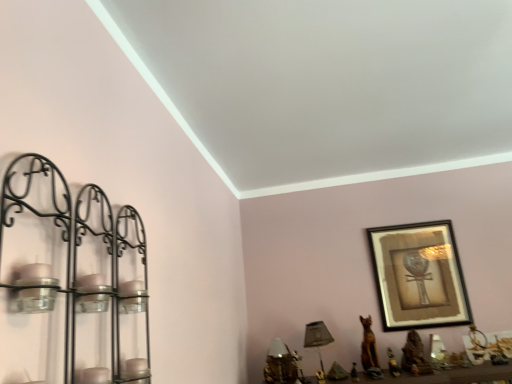
The height and width of the screenshot is (384, 512). What do you see at coordinates (317, 337) in the screenshot?
I see `green fabric table lamp at lower center, the 1th table lamp in the right-to-left sequence` at bounding box center [317, 337].

The width and height of the screenshot is (512, 384). I want to click on green fabric table lamp at lower center, the 1th table lamp in the right-to-left sequence, so click(x=317, y=337).

Which object is thinner, green fabric table lamp at lower center, which is the second table lamp in left-to-right order, or black metal candle holder at left?

black metal candle holder at left.

Relative to black metal candle holder at left, is green fabric table lamp at lower center, the 1th table lamp in the right-to-left sequence, in front or behind?

Visually, green fabric table lamp at lower center, the 1th table lamp in the right-to-left sequence, is located behind black metal candle holder at left.

From the image's perspective, is green fabric table lamp at lower center, the 1th table lamp in the right-to-left sequence, under black metal candle holder at left?

Indeed, from the image's perspective, green fabric table lamp at lower center, the 1th table lamp in the right-to-left sequence, is shown beneath black metal candle holder at left.

Is green fabric table lamp at lower center, which is the second table lamp in left-to-right order, to the left of black metal candle holder at left from the viewer's perspective?

Incorrect, green fabric table lamp at lower center, which is the second table lamp in left-to-right order, is not on the left side of black metal candle holder at left.

Considering the sizes of gold metallic table lamp at lower center, positioned as the 2th table lamp in right-to-left order, and wooden framed picture at upper right in the image, is gold metallic table lamp at lower center, positioned as the 2th table lamp in right-to-left order, wider or thinner than wooden framed picture at upper right?

gold metallic table lamp at lower center, positioned as the 2th table lamp in right-to-left order, is wider than wooden framed picture at upper right.

Find the location of `picture frame behind the gold metallic table lamp at lower center, the first table lamp viewed from the left`. picture frame behind the gold metallic table lamp at lower center, the first table lamp viewed from the left is located at coordinates (419, 276).

Can we say gold metallic table lamp at lower center, positioned as the 2th table lamp in right-to-left order, lies outside wooden framed picture at upper right?

Yes, gold metallic table lamp at lower center, positioned as the 2th table lamp in right-to-left order, is not within wooden framed picture at upper right.

Which point is more distant from viewer, (286, 363) or (402, 255)?

Positioned behind is point (402, 255).

From the image's perspective, is black metal candle holder at left over gold metallic table lamp at lower center, positioned as the 2th table lamp in right-to-left order?

Yes, from the image's perspective, black metal candle holder at left is on top of gold metallic table lamp at lower center, positioned as the 2th table lamp in right-to-left order.

How different are the orientations of black metal candle holder at left and gold metallic table lamp at lower center, the first table lamp viewed from the left, in degrees?

86.7 degrees.

Is black metal candle holder at left further to the viewer compared to gold metallic table lamp at lower center, positioned as the 2th table lamp in right-to-left order?

No, it is in front of gold metallic table lamp at lower center, positioned as the 2th table lamp in right-to-left order.

Between black metal candle holder at left and gold metallic table lamp at lower center, the first table lamp viewed from the left, which one has more height?

black metal candle holder at left is taller.

Considering the sizes of objects wooden framed picture at upper right and green fabric table lamp at lower center, which is the second table lamp in left-to-right order, in the image provided, who is shorter, wooden framed picture at upper right or green fabric table lamp at lower center, which is the second table lamp in left-to-right order,?

green fabric table lamp at lower center, which is the second table lamp in left-to-right order, is shorter.

Looking at this image, which object is positioned more to the left, wooden framed picture at upper right or green fabric table lamp at lower center, the 1th table lamp in the right-to-left sequence?

green fabric table lamp at lower center, the 1th table lamp in the right-to-left sequence, is more to the left.

Does wooden framed picture at upper right have a larger size compared to green fabric table lamp at lower center, the 1th table lamp in the right-to-left sequence?

Yes, wooden framed picture at upper right is bigger than green fabric table lamp at lower center, the 1th table lamp in the right-to-left sequence.

Looking at this image, does green fabric table lamp at lower center, which is the second table lamp in left-to-right order, have a lesser height compared to wooden framed picture at upper right?

Yes.

From the image's perspective, is green fabric table lamp at lower center, the 1th table lamp in the right-to-left sequence, below wooden framed picture at upper right?

Yes, from the image's perspective, green fabric table lamp at lower center, the 1th table lamp in the right-to-left sequence, is below wooden framed picture at upper right.

Find the location of a particular element. table lamp that is the 1st object located below the wooden framed picture at upper right (from the image's perspective) is located at coordinates [317, 337].

Does green fabric table lamp at lower center, which is the second table lamp in left-to-right order, turn towards wooden framed picture at upper right?

No.

Considering the relative positions of black metal candle holder at left and wooden framed picture at upper right in the image provided, is black metal candle holder at left to the left of wooden framed picture at upper right from the viewer's perspective?

Yes.

Considering the positions of objects black metal candle holder at left and wooden framed picture at upper right in the image provided, who is behind, black metal candle holder at left or wooden framed picture at upper right?

wooden framed picture at upper right is further from the camera.

Is black metal candle holder at left aimed at wooden framed picture at upper right?

No, black metal candle holder at left is not aimed at wooden framed picture at upper right.

Which object is thinner, black metal candle holder at left or wooden framed picture at upper right?

With smaller width is wooden framed picture at upper right.

Considering the positions of objects gold metallic table lamp at lower center, positioned as the 2th table lamp in right-to-left order, and green fabric table lamp at lower center, the 1th table lamp in the right-to-left sequence, in the image provided, who is more to the left, gold metallic table lamp at lower center, positioned as the 2th table lamp in right-to-left order, or green fabric table lamp at lower center, the 1th table lamp in the right-to-left sequence,?

gold metallic table lamp at lower center, positioned as the 2th table lamp in right-to-left order, is more to the left.

Would you say gold metallic table lamp at lower center, positioned as the 2th table lamp in right-to-left order, is outside green fabric table lamp at lower center, which is the second table lamp in left-to-right order?

That's correct, gold metallic table lamp at lower center, positioned as the 2th table lamp in right-to-left order, is outside of green fabric table lamp at lower center, which is the second table lamp in left-to-right order.

From the image's perspective, who appears lower, gold metallic table lamp at lower center, positioned as the 2th table lamp in right-to-left order, or green fabric table lamp at lower center, which is the second table lamp in left-to-right order?

gold metallic table lamp at lower center, positioned as the 2th table lamp in right-to-left order, is shown below in the image.

The height and width of the screenshot is (384, 512). Find the location of `table lamp lying above the gold metallic table lamp at lower center, the first table lamp viewed from the left (from the image's perspective)`. table lamp lying above the gold metallic table lamp at lower center, the first table lamp viewed from the left (from the image's perspective) is located at coordinates (317, 337).

Locate an element on the screen. The width and height of the screenshot is (512, 384). the 2nd table lamp behind the black metal candle holder at left is located at coordinates (317, 337).

The image size is (512, 384). In order to click on picture frame that is above the gold metallic table lamp at lower center, the first table lamp viewed from the left (from the image's perspective) in this screenshot , I will do `click(419, 276)`.

Estimate the real-world distances between objects in this image. Which object is further from wooden framed picture at upper right, green fabric table lamp at lower center, the 1th table lamp in the right-to-left sequence, or gold metallic table lamp at lower center, positioned as the 2th table lamp in right-to-left order?

gold metallic table lamp at lower center, positioned as the 2th table lamp in right-to-left order.

From the image, which object appears to be nearer to green fabric table lamp at lower center, which is the second table lamp in left-to-right order, gold metallic table lamp at lower center, positioned as the 2th table lamp in right-to-left order, or black metal candle holder at left?

gold metallic table lamp at lower center, positioned as the 2th table lamp in right-to-left order, is closer to green fabric table lamp at lower center, which is the second table lamp in left-to-right order.

Considering their positions, is black metal candle holder at left positioned closer to gold metallic table lamp at lower center, the first table lamp viewed from the left, than wooden framed picture at upper right?

Based on the image, wooden framed picture at upper right appears to be nearer to gold metallic table lamp at lower center, the first table lamp viewed from the left.

Estimate the real-world distances between objects in this image. Which object is further from green fabric table lamp at lower center, which is the second table lamp in left-to-right order, black metal candle holder at left or wooden framed picture at upper right?

black metal candle holder at left is positioned further to the anchor green fabric table lamp at lower center, which is the second table lamp in left-to-right order.

Estimate the real-world distances between objects in this image. Which object is further from gold metallic table lamp at lower center, positioned as the 2th table lamp in right-to-left order, green fabric table lamp at lower center, the 1th table lamp in the right-to-left sequence, or black metal candle holder at left?

The object further to gold metallic table lamp at lower center, positioned as the 2th table lamp in right-to-left order, is black metal candle holder at left.

Considering their positions, is wooden framed picture at upper right positioned further to gold metallic table lamp at lower center, the first table lamp viewed from the left, than black metal candle holder at left?

Among the two, black metal candle holder at left is located further to gold metallic table lamp at lower center, the first table lamp viewed from the left.

Estimate the real-world distances between objects in this image. Which object is further from wooden framed picture at upper right, green fabric table lamp at lower center, the 1th table lamp in the right-to-left sequence, or black metal candle holder at left?

Among the two, black metal candle holder at left is located further to wooden framed picture at upper right.

Considering their positions, is green fabric table lamp at lower center, the 1th table lamp in the right-to-left sequence, positioned further to black metal candle holder at left than wooden framed picture at upper right?

The object further to black metal candle holder at left is wooden framed picture at upper right.

This screenshot has height=384, width=512. What are the coordinates of `table lamp located between black metal candle holder at left and green fabric table lamp at lower center, which is the second table lamp in left-to-right order, in the depth direction` in the screenshot? It's located at (279, 364).

I want to click on table lamp between gold metallic table lamp at lower center, the first table lamp viewed from the left, and wooden framed picture at upper right from left to right, so click(x=317, y=337).